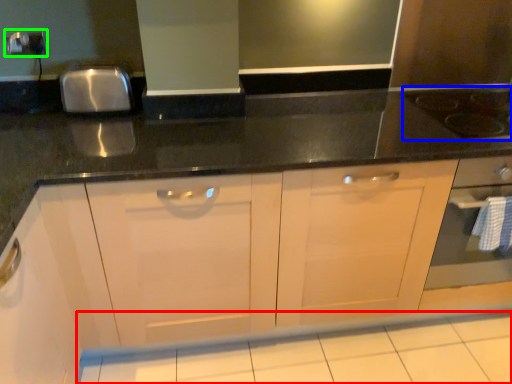
Question: Considering the real-world distances, which object is closest to tile (highlighted by a red box)? gas stove (highlighted by a blue box) or electric outlet (highlighted by a green box).

Choices:
 (A) gas stove
 (B) electric outlet

Answer: (A)